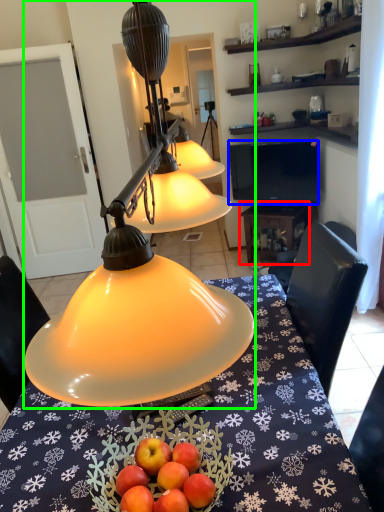
Question: Estimate the real-world distances between objects in this image. Which object is closer to table (highlighted by a red box), television (highlighted by a blue box) or lamp (highlighted by a green box)?

Choices:
 (A) television
 (B) lamp

Answer: (A)